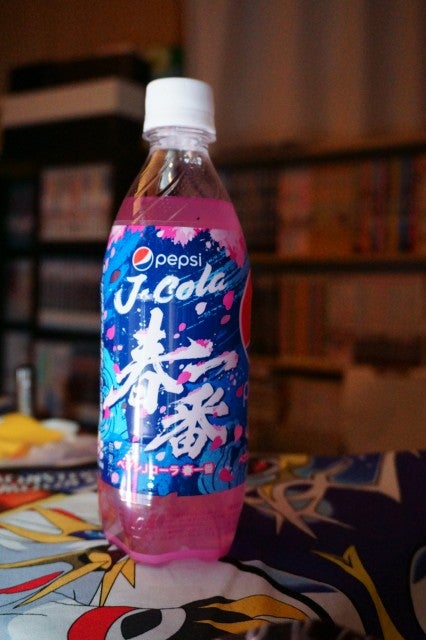
Identify the location of blanket. This screenshot has height=640, width=426. click(x=293, y=532).